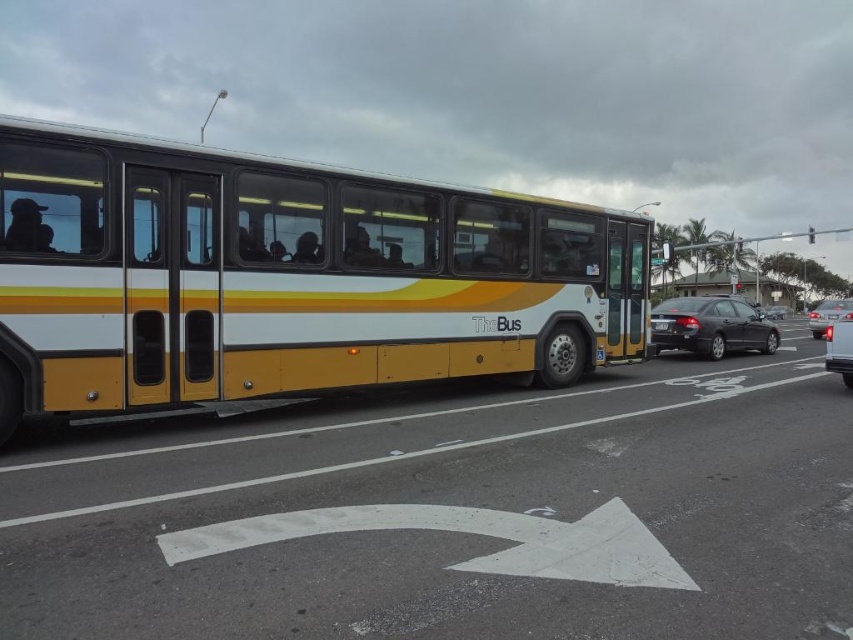
Who is positioned more to the right, satin black sedan at center or shiny silver sedan at right?

Positioned to the right is shiny silver sedan at right.

Identify the location of satin black sedan at center. (712, 326).

Locate an element on the screen. This screenshot has width=853, height=640. satin black sedan at center is located at coordinates (712, 326).

Which is more to the right, yellow matte bus at center or black plastic license plate at center?

From the viewer's perspective, black plastic license plate at center appears more on the right side.

Who is taller, yellow matte bus at center or black plastic license plate at center?

With more height is yellow matte bus at center.

Between point (281, 324) and point (660, 317), which one is positioned behind?

Point (660, 317)

At what (x,y) coordinates should I click in order to perform the action: click on yellow matte bus at center. Please return your answer as a coordinate pair (x, y). Looking at the image, I should click on (286, 276).

Who is lower down, glossy silver sedan at right or shiny silver sedan at right?

glossy silver sedan at right

Is point (844, 371) positioned before point (811, 333)?

Yes, point (844, 371) is in front of point (811, 333).

This screenshot has height=640, width=853. What are the coordinates of `glossy silver sedan at right` in the screenshot? It's located at (839, 348).